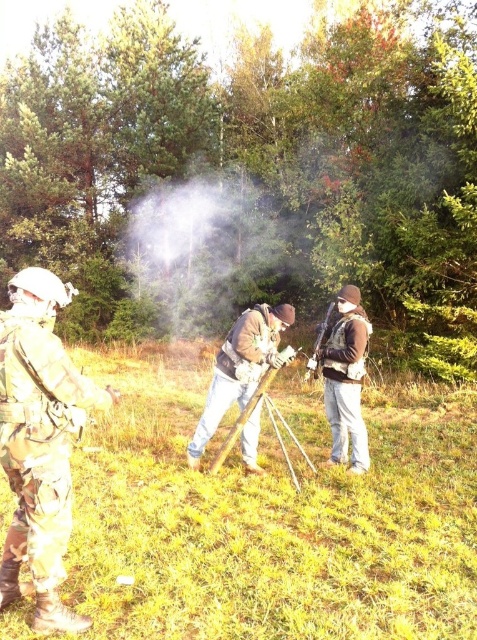
Question: Which object appears closest to the camera in this image?

Choices:
 (A) camo uniform at left
 (B) wooden tripod at center

Answer: (A)

Question: Is camo uniform at left further to camera compared to wooden tripod at center?

Choices:
 (A) yes
 (B) no

Answer: (B)

Question: Which of the following is the closest to the observer?

Choices:
 (A) camouflage uniform at center
 (B) matte black rifle at center
 (C) wooden tripod at center
 (D) brown leather backpack at center

Answer: (C)

Question: Can you confirm if wooden tripod at center is positioned above matte black rifle at center?

Choices:
 (A) no
 (B) yes

Answer: (A)

Question: Which point is farther from the camera taking this photo?

Choices:
 (A) (304, 458)
 (B) (329, 314)
 (C) (52, 333)

Answer: (B)

Question: Is camouflage uniform at center positioned behind wooden tripod at center?

Choices:
 (A) yes
 (B) no

Answer: (A)